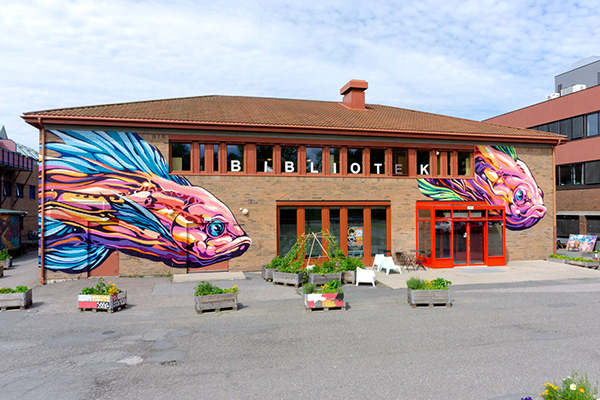
This screenshot has height=400, width=600. I want to click on chimney, so click(355, 99).